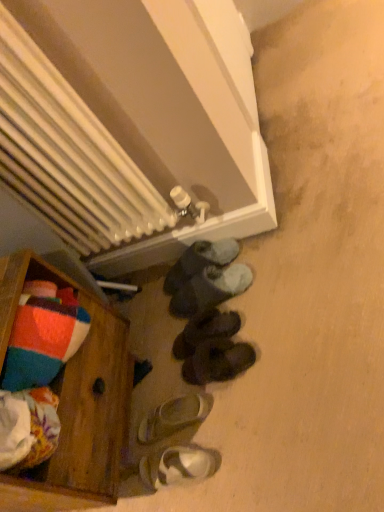
At what (x,y) coordinates should I click in order to perform the action: click on free space to the left of black suede slippers at center, which is counted as the third footwear, starting from the top. Please return your answer as a coordinate pair (x, y). Looking at the image, I should click on (154, 362).